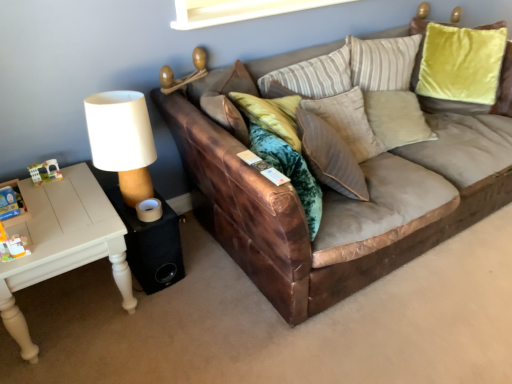
Question: From the image's perspective, is black fabric speaker at lower left above or below white painted wood table at left?

Choices:
 (A) above
 (B) below

Answer: (A)

Question: Considering their positions, is black fabric speaker at lower left located in front of or behind white painted wood table at left?

Choices:
 (A) front
 (B) behind

Answer: (B)

Question: Estimate the real-world distances between objects in this image. Which object is closer to the black fabric speaker at lower left?

Choices:
 (A) brown leather couch at center
 (B) white painted wood table at left
 (C) suede-like beige pillow at center

Answer: (B)

Question: Which is farther from the brown leather couch at center?

Choices:
 (A) black fabric speaker at lower left
 (B) white painted wood table at left
 (C) suede-like beige pillow at center

Answer: (B)